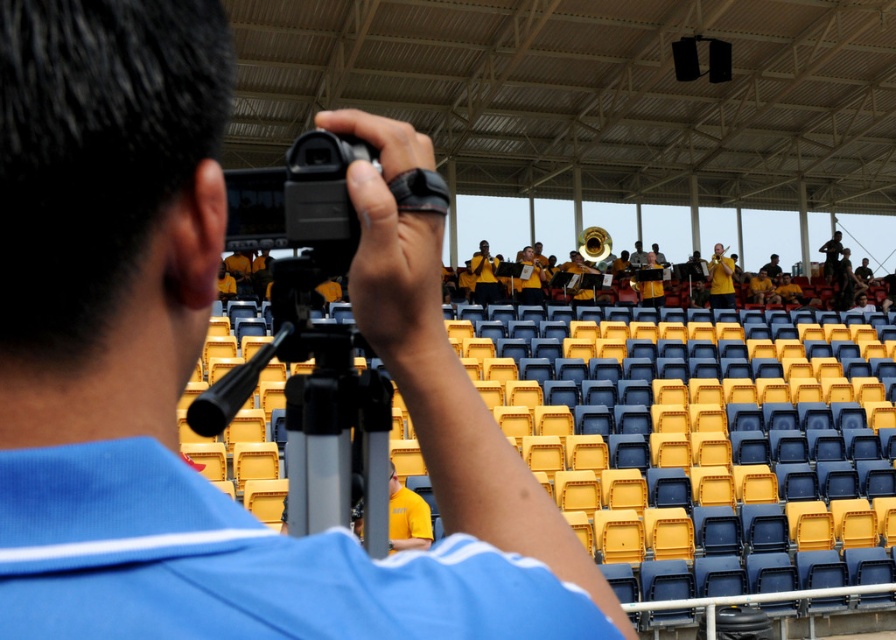
Based on the photo, between black plastic tripod at center and yellow matte uniform at center, which one appears on the left side from the viewer's perspective?

Positioned to the left is black plastic tripod at center.

Which of these two, black plastic tripod at center or yellow matte uniform at center, stands shorter?

Standing shorter between the two is black plastic tripod at center.

Between point (380, 388) and point (722, 262), which one is positioned behind?

The point (722, 262) is behind.

This screenshot has height=640, width=896. I want to click on black plastic tripod at center, so click(317, 410).